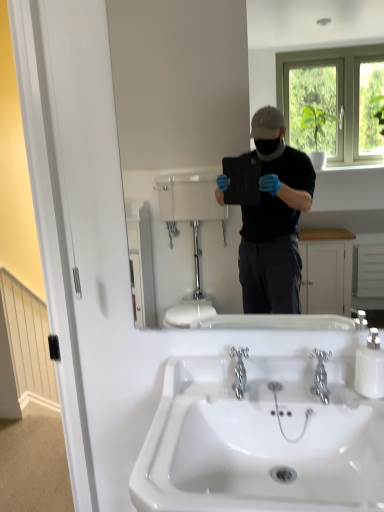
Question: Can you confirm if white glossy sink at center is taller than matte black tablet at center?

Choices:
 (A) no
 (B) yes

Answer: (A)

Question: Does white glossy sink at center come in front of matte black tablet at center?

Choices:
 (A) yes
 (B) no

Answer: (A)

Question: From the image's perspective, would you say white glossy sink at center is positioned over matte black tablet at center?

Choices:
 (A) no
 (B) yes

Answer: (A)

Question: Considering the relative sizes of white glossy sink at center and matte black tablet at center in the image provided, is white glossy sink at center thinner than matte black tablet at center?

Choices:
 (A) yes
 (B) no

Answer: (B)

Question: Does white glossy sink at center have a smaller size compared to matte black tablet at center?

Choices:
 (A) yes
 (B) no

Answer: (B)

Question: In terms of width, does chrome metallic faucet at center, which is the first plumbing fixture from left to right, look wider or thinner when compared to matte black tablet at center?

Choices:
 (A) thin
 (B) wide

Answer: (B)

Question: Is chrome metallic faucet at center, the second plumbing fixture from the right, situated inside matte black tablet at center or outside?

Choices:
 (A) outside
 (B) inside

Answer: (A)

Question: Looking at the image, does chrome metallic faucet at center, the second plumbing fixture from the right, seem bigger or smaller compared to matte black tablet at center?

Choices:
 (A) small
 (B) big

Answer: (A)

Question: From a real-world perspective, is chrome metallic faucet at center, the second plumbing fixture from the right, above or below matte black tablet at center?

Choices:
 (A) below
 (B) above

Answer: (A)

Question: From a real-world perspective, is white glossy soap dispenser at right positioned above or below polished chrome faucet at center, which ranks as the 1th plumbing fixture in right-to-left order?

Choices:
 (A) above
 (B) below

Answer: (A)

Question: Would you say white glossy soap dispenser at right is to the left or to the right of polished chrome faucet at center, which ranks as the 1th plumbing fixture in right-to-left order, in the picture?

Choices:
 (A) right
 (B) left

Answer: (A)

Question: In terms of height, does white glossy soap dispenser at right look taller or shorter compared to polished chrome faucet at center, which ranks as the 1th plumbing fixture in right-to-left order?

Choices:
 (A) short
 (B) tall

Answer: (B)

Question: From the image's perspective, is white glossy soap dispenser at right above or below polished chrome faucet at center, which is counted as the 2th plumbing fixture, starting from the left?

Choices:
 (A) below
 (B) above

Answer: (B)

Question: In terms of width, does matte black tablet at center look wider or thinner when compared to white glossy soap dispenser at right?

Choices:
 (A) wide
 (B) thin

Answer: (B)

Question: Does point (162, 116) appear closer or farther from the camera than point (370, 387)?

Choices:
 (A) farther
 (B) closer

Answer: (A)